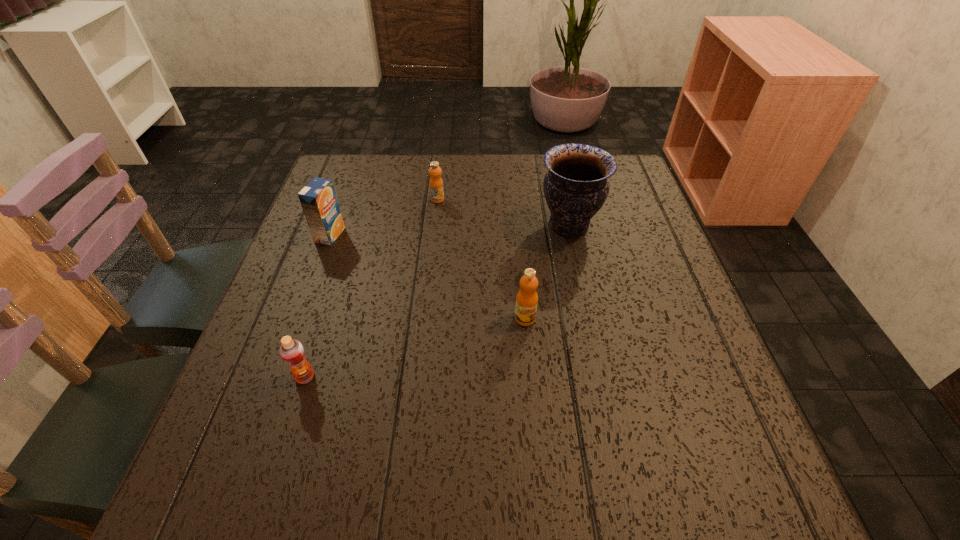
Where is `free space between the pottery and the third nearest orange juice`? free space between the pottery and the third nearest orange juice is located at coordinates (449, 230).

Locate an element on the screen. unoccupied area between the third object from right to left and the nearest orange juice is located at coordinates (372, 288).

This screenshot has height=540, width=960. What are the coordinates of `free area in between the third object from right to left and the third farthest orange juice` in the screenshot? It's located at click(x=481, y=259).

This screenshot has width=960, height=540. Identify the location of vacant space in between the pottery and the farthest orange juice. (503, 212).

Identify the location of object that is the second closest one to the third nearest orange juice. The image size is (960, 540). (292, 352).

This screenshot has height=540, width=960. Find the location of `the closest object relative to the pottery`. the closest object relative to the pottery is located at coordinates (527, 298).

Find the location of `orange juice that is the third closest to the fourth object from left to right`. orange juice that is the third closest to the fourth object from left to right is located at coordinates (318, 199).

Point out which orange juice is positioned as the nearest to the second farthest orange juice. Please provide its 2D coordinates. Your answer should be formatted as a tuple, i.e. [(x, y)], where the tuple contains the x and y coordinates of a point satisfying the conditions above.

[(436, 184)]

Where is `free space that satisfies the following two spatial constraints: 1. on the front handle of the rightmost object; 2. on the front side of the nearest object`? The height and width of the screenshot is (540, 960). free space that satisfies the following two spatial constraints: 1. on the front handle of the rightmost object; 2. on the front side of the nearest object is located at coordinates (603, 377).

Find the location of a particular element. vacant region that satisfies the following two spatial constraints: 1. on the front handle of the pottery; 2. on the front label of the fourth farthest object is located at coordinates (589, 319).